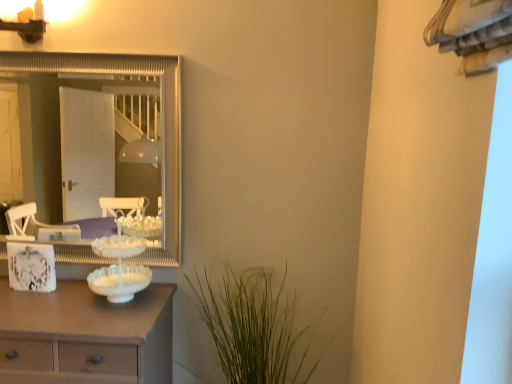
Identify the location of vacant area to the left of matte white picture frame at left. (6, 292).